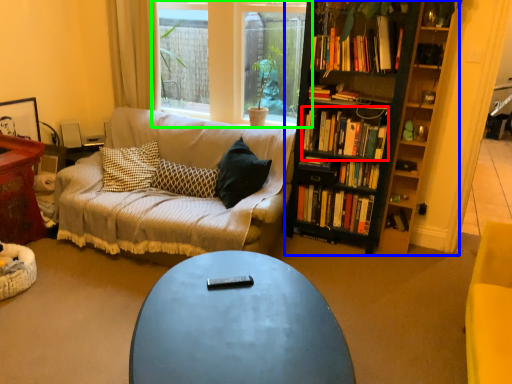
Question: Based on their relative distances, which object is nearer to book (highlighted by a red box)? Choose from bookcase (highlighted by a blue box) and window (highlighted by a green box).

Choices:
 (A) bookcase
 (B) window

Answer: (A)